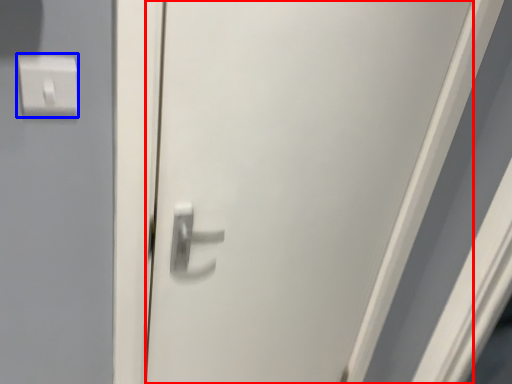
Question: Among these objects, which one is nearest to the camera, door (highlighted by a red box) or light switch (highlighted by a blue box)?

Choices:
 (A) door
 (B) light switch

Answer: (A)